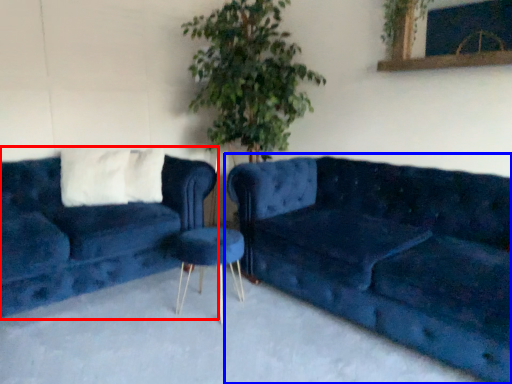
Question: Which of the following is the farthest to the observer, studio couch (highlighted by a red box) or studio couch (highlighted by a blue box)?

Choices:
 (A) studio couch
 (B) studio couch

Answer: (A)